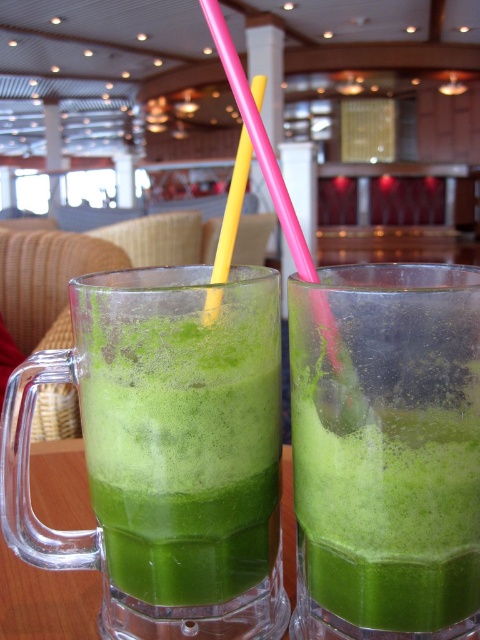
Does green frothy smoothie at center have a smaller size compared to yellow plastic straw at center?

Incorrect, green frothy smoothie at center is not smaller in size than yellow plastic straw at center.

Does point (365, 326) lie in front of point (325, 353)?

Yes, it is.

Locate an element on the screen. Image resolution: width=480 pixels, height=640 pixels. green frothy smoothie at center is located at coordinates [x=385, y=451].

How distant is green frosted glass mug at left from yellow plastic straw at center?

green frosted glass mug at left and yellow plastic straw at center are 5.19 centimeters apart.

Between green frosted glass mug at left and yellow plastic straw at center, which one has more height?

Standing taller between the two is yellow plastic straw at center.

Who is more forward, (146, 342) or (297, 218)?

Positioned in front is point (146, 342).

This screenshot has height=640, width=480. I want to click on green frosted glass mug at left, so click(x=181, y=433).

Can you confirm if green frothy smoothie at center is positioned to the right of green frosted glass mug at left?

Correct, you'll find green frothy smoothie at center to the right of green frosted glass mug at left.

The height and width of the screenshot is (640, 480). I want to click on green frothy smoothie at center, so click(x=385, y=451).